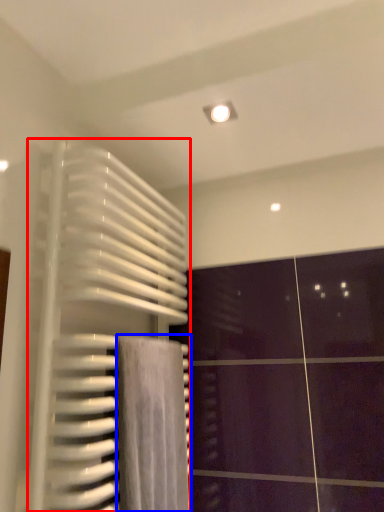
Question: Which point is closer to the camera, radiator (highlighted by a red box) or bath towel (highlighted by a blue box)?

Choices:
 (A) radiator
 (B) bath towel

Answer: (A)